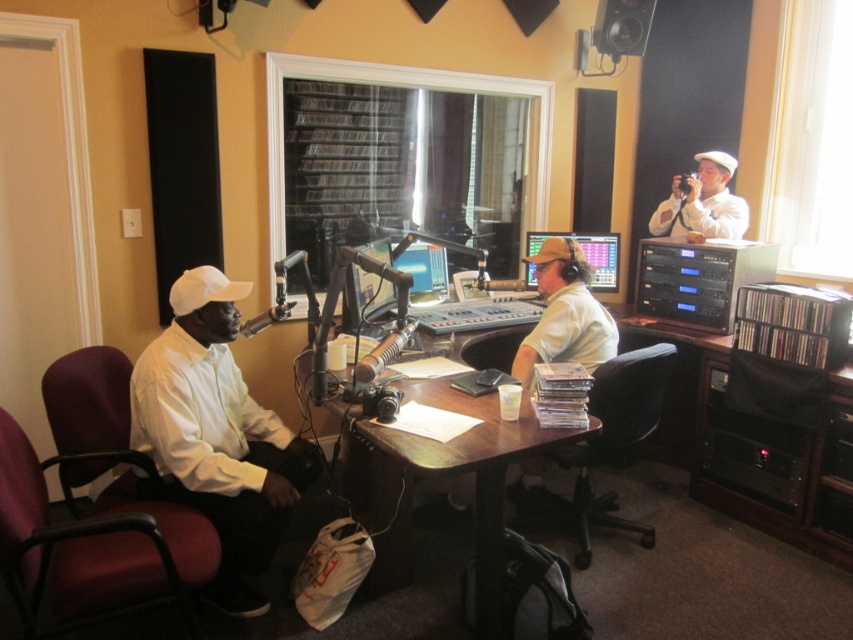
Can you confirm if transparent plastic cd rack at right is thinner than wooden desk at center?

Indeed, transparent plastic cd rack at right has a lesser width compared to wooden desk at center.

Does point (717, 378) come in front of point (349, 483)?

No, (717, 378) is further to viewer.

Who is more distant from viewer, (827, 534) or (489, 493)?

Positioned behind is point (827, 534).

At what (x,y) coordinates should I click in order to perform the action: click on transparent plastic cd rack at right. Please return your answer as a coordinate pair (x, y). Image resolution: width=853 pixels, height=640 pixels. Looking at the image, I should click on (740, 445).

Does white matte hat at upper right come behind matte black monitor at center?

No, white matte hat at upper right is in front of matte black monitor at center.

Which is in front, point (695, 182) or point (602, 243)?

Point (695, 182) is more forward.

Is point (706, 173) closer to camera compared to point (549, 236)?

No, it is not.

The width and height of the screenshot is (853, 640). I want to click on white matte hat at upper right, so click(x=701, y=202).

Which is more to the right, white matte shirt at left or white matte hat at upper right?

white matte hat at upper right

Can you confirm if white matte shirt at left is smaller than white matte hat at upper right?

No, white matte shirt at left is not smaller than white matte hat at upper right.

Is point (206, 440) farther from viewer compared to point (693, 228)?

That is False.

The height and width of the screenshot is (640, 853). I want to click on white matte shirt at left, so click(x=216, y=436).